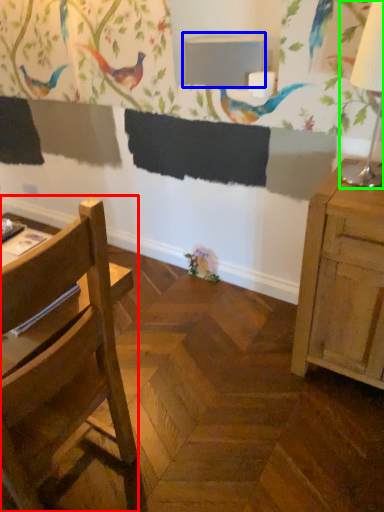
Question: Which object is positioned closest to chair (highlighted by a red box)? Select from table (highlighted by a blue box) and table lamp (highlighted by a green box).

Choices:
 (A) table
 (B) table lamp

Answer: (B)